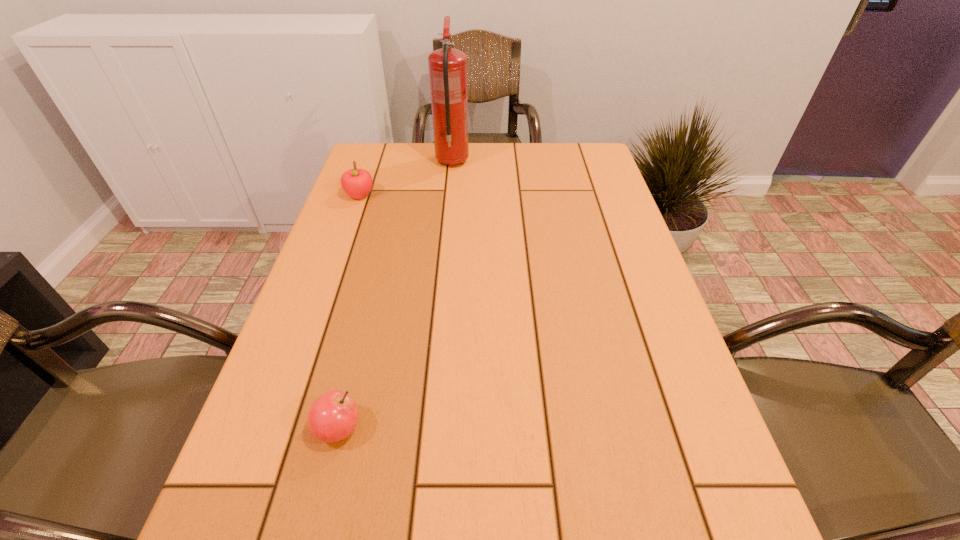
Locate an element on the screen. the rightmost object is located at coordinates (447, 67).

Where is `the farthest object`? This screenshot has height=540, width=960. the farthest object is located at coordinates (447, 67).

You are a GUI agent. You are given a task and a screenshot of the screen. Output one action in this format:
    pyautogui.click(x=<x>, y=<y>)
    Task: Click on the leftmost object
    The width and height of the screenshot is (960, 540).
    Given the screenshot: What is the action you would take?
    pyautogui.click(x=357, y=183)

The image size is (960, 540). I want to click on the second shortest object, so click(x=357, y=183).

Image resolution: width=960 pixels, height=540 pixels. What are the coordinates of `the shortest object` in the screenshot? It's located at (332, 417).

The image size is (960, 540). In order to click on the right apple in this screenshot , I will do `click(332, 417)`.

Where is `vacant region located on the handle side the farthest object`? vacant region located on the handle side the farthest object is located at coordinates (454, 143).

Where is `free region located on the back of the taller apple`? This screenshot has height=540, width=960. free region located on the back of the taller apple is located at coordinates (372, 157).

The height and width of the screenshot is (540, 960). Find the location of `vacant space situated 0.340m on the back of the nearer apple`. vacant space situated 0.340m on the back of the nearer apple is located at coordinates (376, 275).

You are a GUI agent. You are given a task and a screenshot of the screen. Output one action in this format:
    pyautogui.click(x=<x>, y=<y>)
    Task: Click on the object present at the far edge
    This screenshot has height=540, width=960.
    Given the screenshot: What is the action you would take?
    pyautogui.click(x=447, y=67)